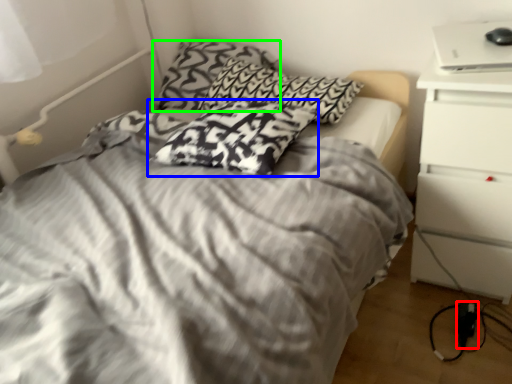
Question: Which object is positioned closest to electric outlet (highlighted by a red box)? Select from pillow (highlighted by a blue box) and pillow (highlighted by a green box).

Choices:
 (A) pillow
 (B) pillow

Answer: (A)